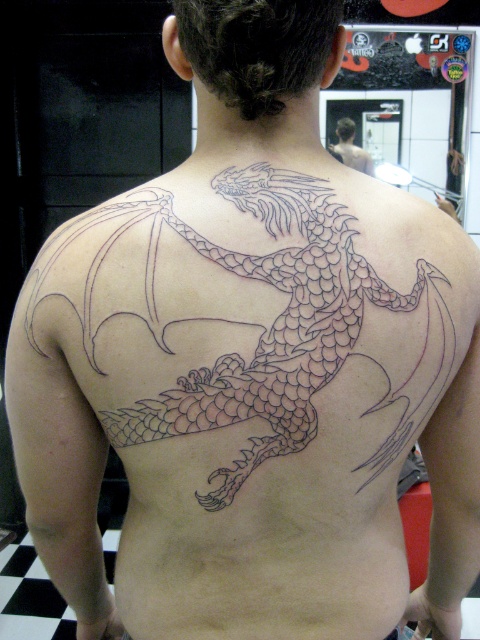
From the picture: You are a tattoo artist assessing the placement of two dragon tattoos on a client. The client has the black line art dragon at center and the black ink dragon at upper center. Which dragon is bigger?

The black line art dragon at center is larger in size than the black ink dragon at upper center.

Consider the image. You are a tattoo artist reviewing a design for a client who wants a dragon tattoo. The design includes a black line art dragon at center and a black ink dragon at upper center. Based on the provided image, which dragon is located lower on the client back?

The black line art dragon at center is positioned under the black ink dragon at upper center, so the black line art dragon at center is located lower on the client back.